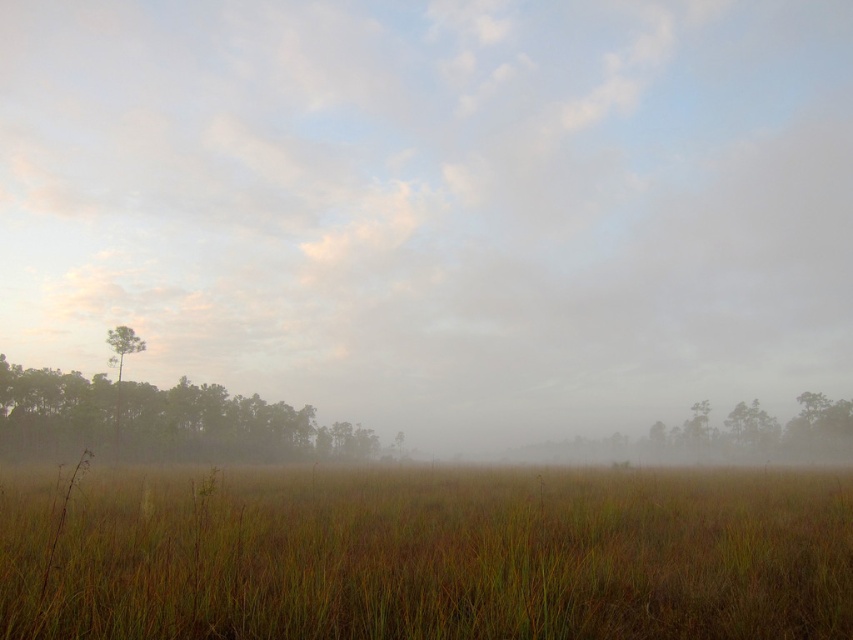
Between foggy grassland at lower center and brown grassy at center, which one is positioned lower?

brown grassy at center is below.

Find the location of a particular element. foggy grassland at lower center is located at coordinates (436, 205).

Find the location of `foggy grassland at lower center`. foggy grassland at lower center is located at coordinates (436, 205).

Between green matte tree at left and green matte tree at center, which one is positioned lower?

green matte tree at center

What do you see at coordinates (160, 420) in the screenshot? I see `green matte tree at left` at bounding box center [160, 420].

Locate an element on the screen. The height and width of the screenshot is (640, 853). green matte tree at left is located at coordinates [160, 420].

Between foggy grassland at lower center and green matte tree at left, which one is positioned higher?

Positioned higher is foggy grassland at lower center.

Can you confirm if foggy grassland at lower center is positioned above green matte tree at left?

Yes, foggy grassland at lower center is above green matte tree at left.

The width and height of the screenshot is (853, 640). I want to click on foggy grassland at lower center, so click(436, 205).

Locate an element on the screen. This screenshot has height=640, width=853. foggy grassland at lower center is located at coordinates (436, 205).